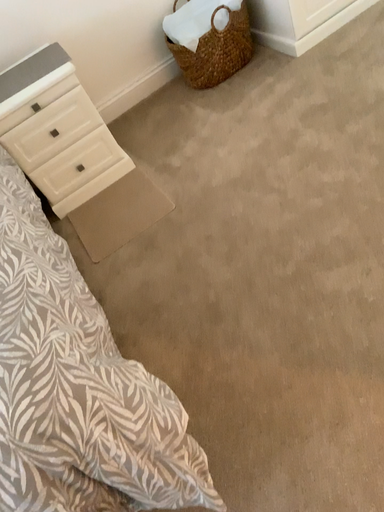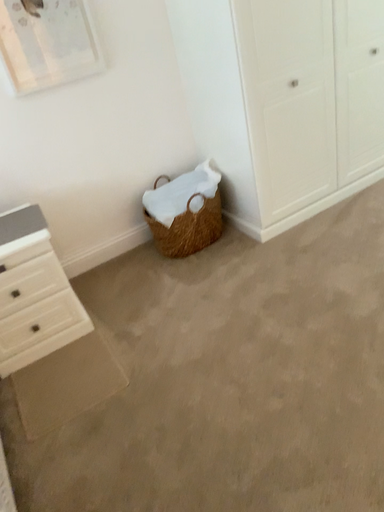
Question: Which way did the camera rotate in the video?

Choices:
 (A) rotated upward
 (B) rotated downward

Answer: (A)